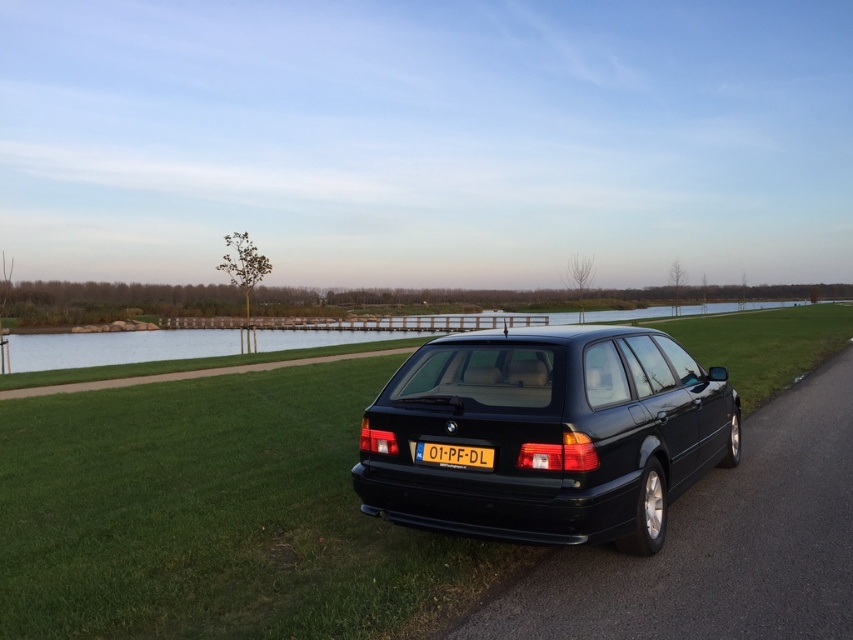
Does green grass at center appear over glossy black station wagon at center?

No.

Is the position of green grass at center more distant than that of glossy black station wagon at center?

No, it is not.

Is point (815, 326) in front of point (662, 364)?

No, it is not.

In order to click on green grass at center in this screenshot , I will do `click(215, 516)`.

Between point (225, 541) and point (451, 449), which one is positioned behind?

The point (225, 541) is more distant.

Between green grass at center and yellow plastic license plate at center, which one has less height?

yellow plastic license plate at center is shorter.

Which is in front, point (329, 618) or point (428, 458)?

Point (329, 618) is in front.

At what (x,y) coordinates should I click in order to perform the action: click on green grass at center. Please return your answer as a coordinate pair (x, y). This screenshot has height=640, width=853. Looking at the image, I should click on (215, 516).

Does glossy black station wagon at center appear on the left side of yellow plastic license plate at center?

Correct, you'll find glossy black station wagon at center to the left of yellow plastic license plate at center.

Who is lower down, glossy black station wagon at center or yellow plastic license plate at center?

yellow plastic license plate at center is below.

At what (x,y) coordinates should I click in order to perform the action: click on glossy black station wagon at center. Please return your answer as a coordinate pair (x, y). Looking at the image, I should click on (547, 435).

What are the coordinates of `glossy black station wagon at center` in the screenshot? It's located at (547, 435).